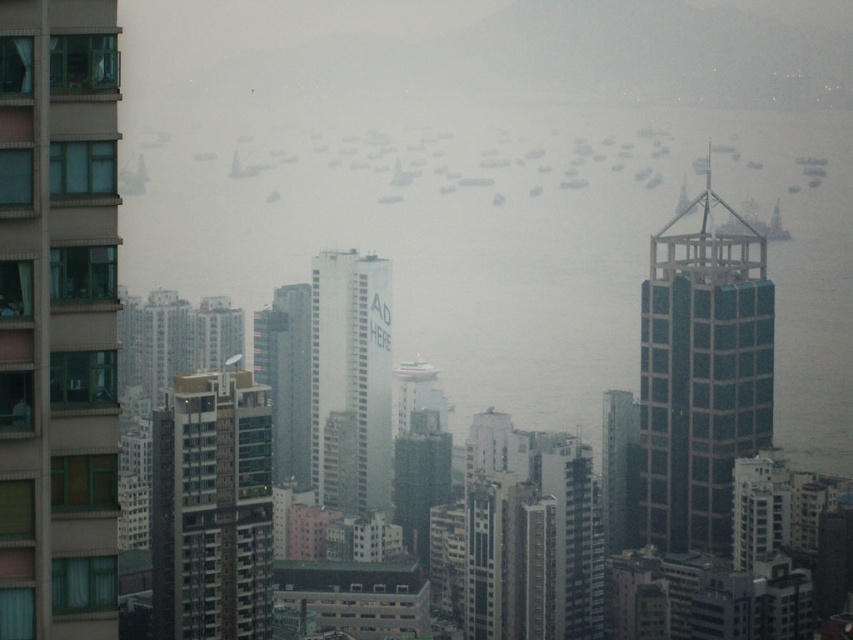
You are a drone operator who needs to fly a drone from the metallic glass building at left to the white matte building at center. Based on the scene description, which direction should you fly the drone to reach the destination?

The metallic glass building at left is to the left of the white matte building at center, so you should fly the drone to the right to reach the destination.

You are a drone operator trying to deliver a package from the brown glass windows at left to the white plastic boat at center. The drone can carry a maximum distance of 80 meters. Can the drone successfully make the delivery?

The brown glass windows at left is 84.19 meters from the white plastic boat at center. Since the distance exceeds the drone delivery limit of 80 meters, the drone cannot make the delivery.

You are a city planner reviewing this urban layout. You notice the foggy water at center and the white matte building at center. Which one is located above the other?

The foggy water at center is positioned over the white matte building at center, so the foggy water at center is above the white matte building at center.